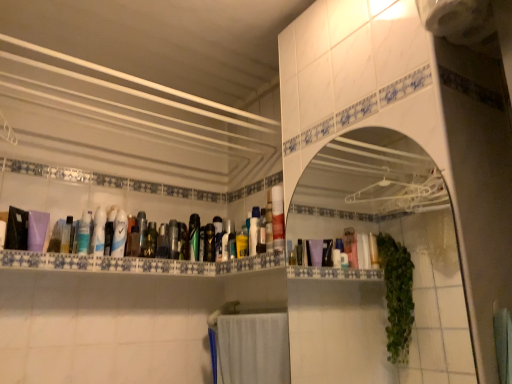
Question: From a real-world perspective, does matte black bottle at center, which is the second toiletry in right-to-left order, sit lower than matte plastic mouthwash at center, which appears as the 8th mouthwash when viewed from the left?

Choices:
 (A) no
 (B) yes

Answer: (B)

Question: Does matte black bottle at center, the fourth toiletry in the left-to-right sequence, have a larger size compared to matte plastic mouthwash at center, which appears as the 8th mouthwash when viewed from the left?

Choices:
 (A) yes
 (B) no

Answer: (B)

Question: Considering the relative sizes of matte black bottle at center, the fourth toiletry in the left-to-right sequence, and matte plastic mouthwash at center, the 3th mouthwash from the right, in the image provided, is matte black bottle at center, the fourth toiletry in the left-to-right sequence, thinner than matte plastic mouthwash at center, the 3th mouthwash from the right,?

Choices:
 (A) no
 (B) yes

Answer: (B)

Question: From the image's perspective, is matte black bottle at center, the fourth toiletry in the left-to-right sequence, on top of matte plastic mouthwash at center, which appears as the 8th mouthwash when viewed from the left?

Choices:
 (A) yes
 (B) no

Answer: (B)

Question: Is matte black bottle at center, the fourth toiletry in the left-to-right sequence, not inside matte plastic mouthwash at center, the 3th mouthwash from the right?

Choices:
 (A) yes
 (B) no

Answer: (A)

Question: Is matte plastic mouthwash at center, which appears as the 8th mouthwash when viewed from the left, situated inside white fabric bath towel at lower center or outside?

Choices:
 (A) outside
 (B) inside

Answer: (A)

Question: Looking at their shapes, would you say matte plastic mouthwash at center, the 3th mouthwash from the right, is wider or thinner than white fabric bath towel at lower center?

Choices:
 (A) wide
 (B) thin

Answer: (B)

Question: In terms of height, does matte plastic mouthwash at center, which appears as the 8th mouthwash when viewed from the left, look taller or shorter compared to white fabric bath towel at lower center?

Choices:
 (A) tall
 (B) short

Answer: (B)

Question: Visually, is matte plastic mouthwash at center, which appears as the 8th mouthwash when viewed from the left, positioned to the left or to the right of white fabric bath towel at lower center?

Choices:
 (A) right
 (B) left

Answer: (B)

Question: Is matte plastic tube at center, the tenth mouthwash viewed from the left, to the left or to the right of green matte bottle at center, placed as the third toiletry when sorted from left to right, in the image?

Choices:
 (A) right
 (B) left

Answer: (A)

Question: In the image, is matte plastic tube at center, the first mouthwash in the right-to-left sequence, positioned in front of or behind green matte bottle at center, the 3th toiletry from the right?

Choices:
 (A) behind
 (B) front

Answer: (B)

Question: Is matte plastic tube at center, the tenth mouthwash viewed from the left, inside or outside of green matte bottle at center, the 3th toiletry from the right?

Choices:
 (A) inside
 (B) outside

Answer: (B)

Question: In terms of height, does matte plastic tube at center, the tenth mouthwash viewed from the left, look taller or shorter compared to green matte bottle at center, placed as the third toiletry when sorted from left to right?

Choices:
 (A) tall
 (B) short

Answer: (A)

Question: Is matte plastic mouthwash at center, which appears as the 8th mouthwash when viewed from the left, situated inside translucent plastic mouthwash at center, which is the 5th mouthwash in left-to-right order, or outside?

Choices:
 (A) inside
 (B) outside

Answer: (B)

Question: Looking at their shapes, would you say matte plastic mouthwash at center, the 3th mouthwash from the right, is wider or thinner than translucent plastic mouthwash at center, positioned as the 6th mouthwash in right-to-left order?

Choices:
 (A) thin
 (B) wide

Answer: (B)